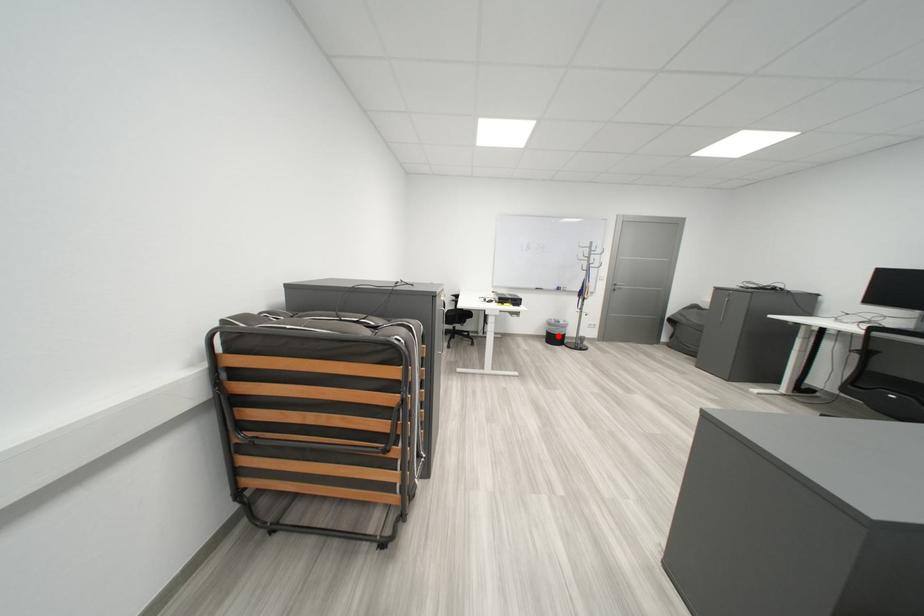
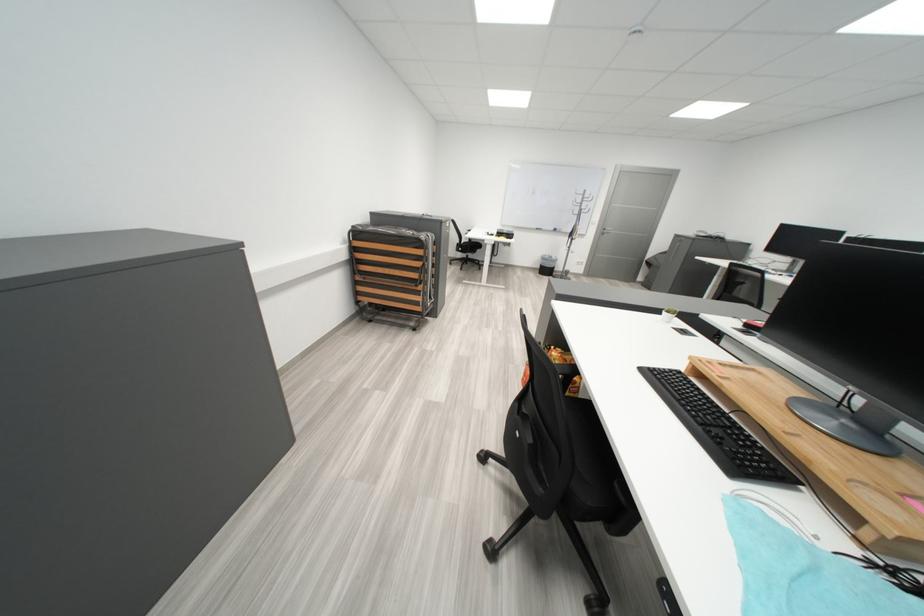
Where in the second image is the point corresponding to the highlighted location from the first image?

(552, 269)